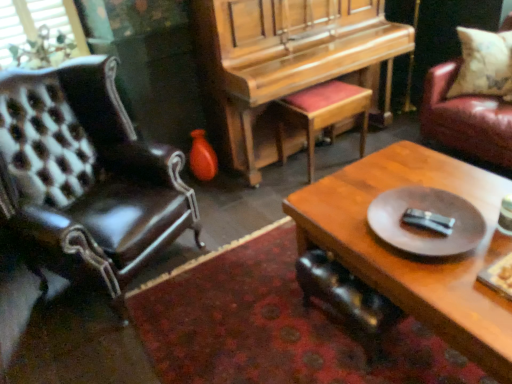
Find the location of a particular element. The image size is (512, 384). vacant area on top of wooden coffee table at center (from a real-world perspective) is located at coordinates (410, 253).